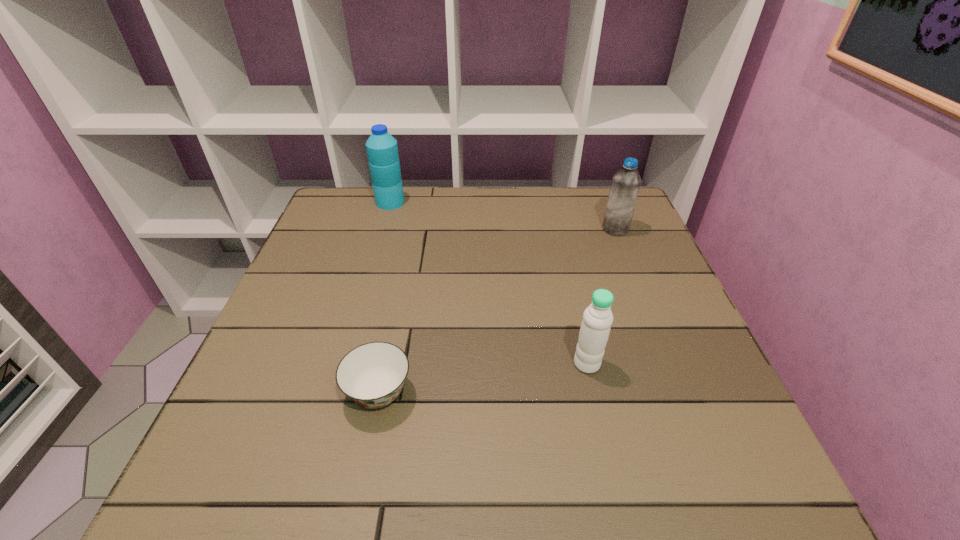
Find the location of a particular element. free space located 0.370m on the back of the soup bowl is located at coordinates (408, 248).

This screenshot has height=540, width=960. In order to click on object present at the left edge in this screenshot , I will do `click(382, 150)`.

You are a GUI agent. You are given a task and a screenshot of the screen. Output one action in this format:
    pyautogui.click(x=<x>, y=<y>)
    Task: Click on the object that is at the right edge
    This screenshot has width=960, height=540.
    Given the screenshot: What is the action you would take?
    pyautogui.click(x=625, y=185)

The height and width of the screenshot is (540, 960). I want to click on object at the far left corner, so click(382, 150).

Where is `object that is at the far right corner`? The height and width of the screenshot is (540, 960). object that is at the far right corner is located at coordinates point(625,185).

The width and height of the screenshot is (960, 540). I want to click on vacant space at the far edge, so click(426, 221).

The height and width of the screenshot is (540, 960). What are the coordinates of `vacant area at the left edge` in the screenshot? It's located at (314, 424).

At what (x,y) coordinates should I click in order to perform the action: click on vacant space at the right edge of the desktop. Please return your answer as a coordinate pair (x, y). Looking at the image, I should click on (620, 284).

The image size is (960, 540). What are the coordinates of `free location at the far left corner` in the screenshot? It's located at (375, 218).

In the image, there is a desktop. At what (x,y) coordinates should I click in order to perform the action: click on vacant space at the near right corner. Please return your answer as a coordinate pair (x, y). Looking at the image, I should click on [x=701, y=480].